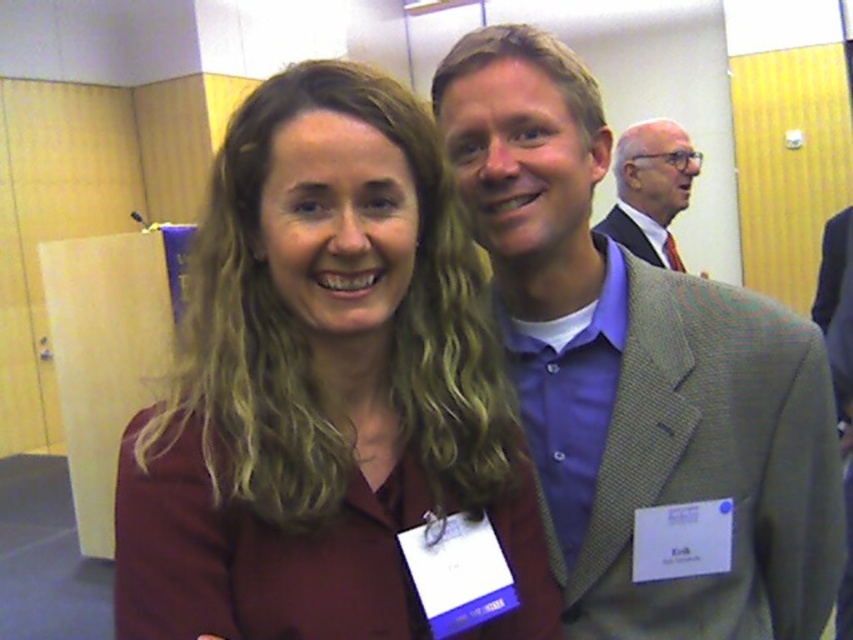
Question: From the image, what is the correct spatial relationship of maroon fabric shirt at center in relation to light brown suit at upper right?

Choices:
 (A) below
 (B) above

Answer: (A)

Question: Among these objects, which one is farthest from the camera?

Choices:
 (A) light brown suit at upper right
 (B) maroon fabric shirt at center

Answer: (A)

Question: Which object is farther from the camera taking this photo?

Choices:
 (A) light brown textured blazer at center
 (B) light brown suit at upper right
 (C) light brown textured suit at upper right
 (D) maroon fabric shirt at center

Answer: (B)

Question: Considering the relative positions of light brown suit at upper right and light brown textured suit at upper right in the image provided, where is light brown suit at upper right located with respect to light brown textured suit at upper right?

Choices:
 (A) right
 (B) left

Answer: (A)

Question: Based on their relative distances, which object is farther from the maroon fabric shirt at center?

Choices:
 (A) light brown textured blazer at center
 (B) light brown textured suit at upper right

Answer: (B)

Question: Is light brown textured blazer at center to the left of light brown suit at upper right from the viewer's perspective?

Choices:
 (A) no
 (B) yes

Answer: (B)